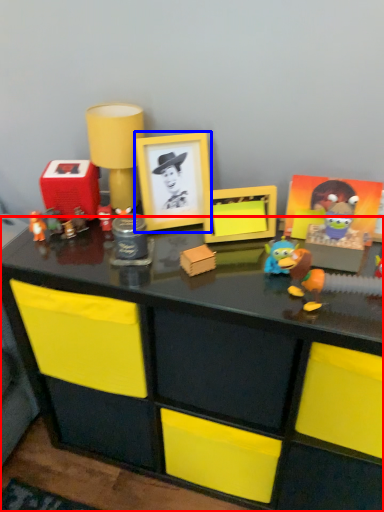
Question: Which object appears closest to the camera in this image, desk (highlighted by a red box) or picture frame (highlighted by a blue box)?

Choices:
 (A) desk
 (B) picture frame

Answer: (A)